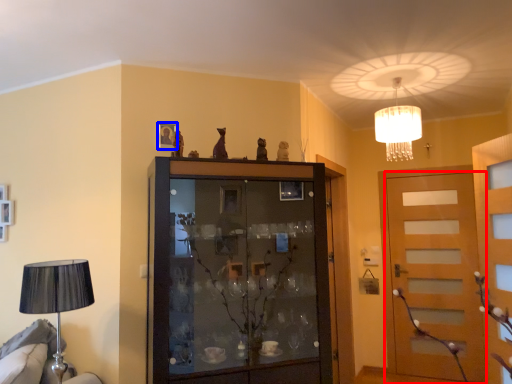
Question: Among these objects, which one is nearest to the camera, door (highlighted by a red box) or picture frame (highlighted by a blue box)?

Choices:
 (A) door
 (B) picture frame

Answer: (B)